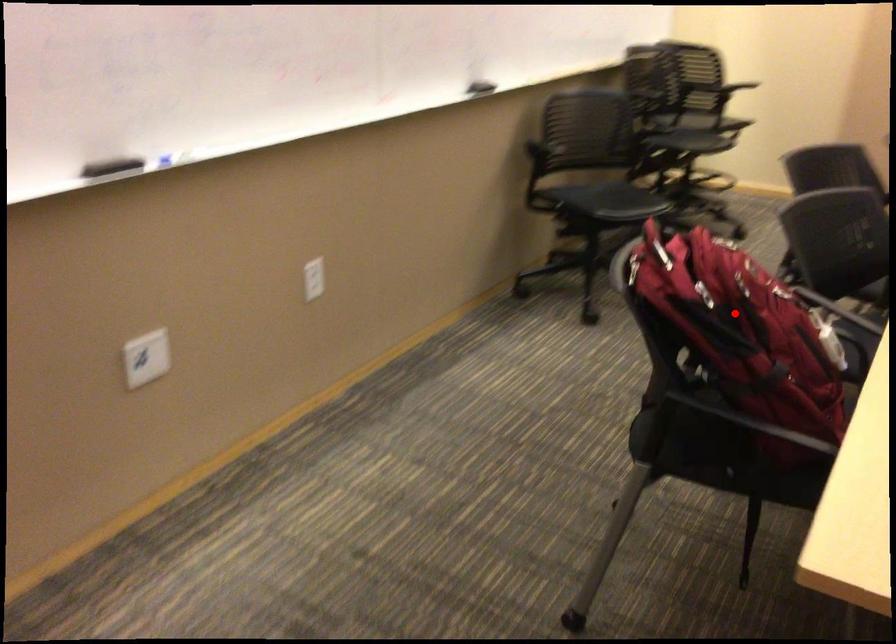
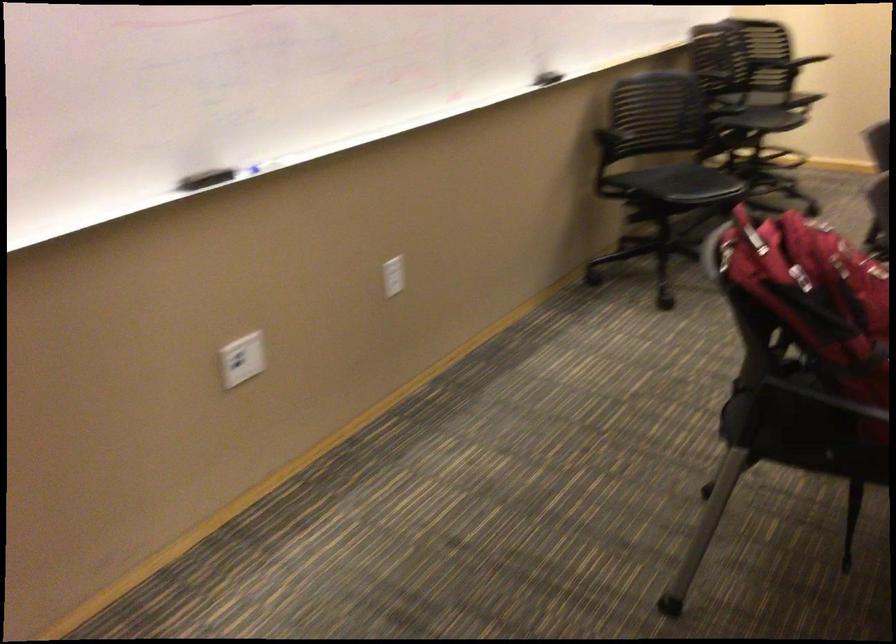
The point at the highlighted location is marked in the first image. Where is the corresponding point in the second image?

(815, 295)